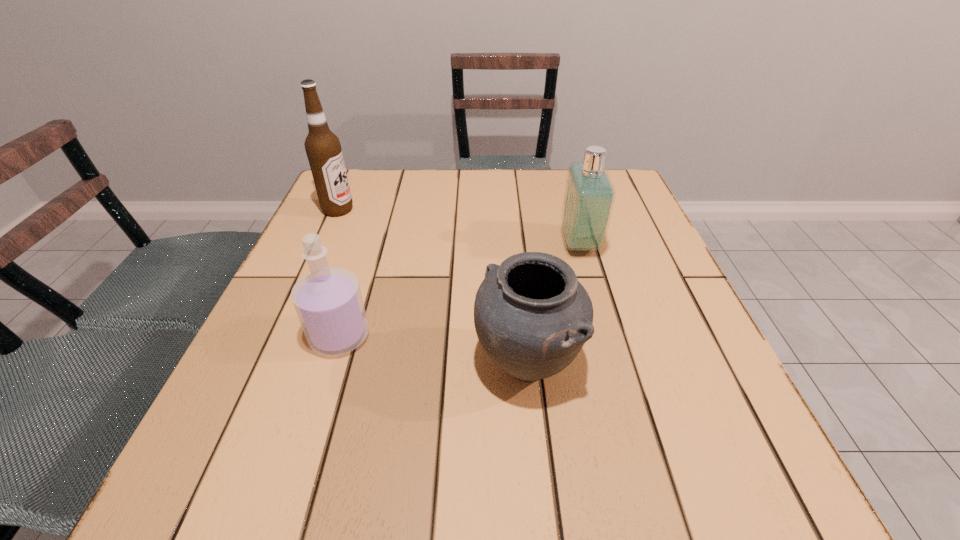
Image resolution: width=960 pixels, height=540 pixels. What are the coordinates of `free spot located 0.390m on the front label of the farther perfume` in the screenshot? It's located at (394, 244).

Image resolution: width=960 pixels, height=540 pixels. Find the location of `vacant space situated 0.190m on the back of the nearer perfume`. vacant space situated 0.190m on the back of the nearer perfume is located at coordinates (366, 254).

This screenshot has height=540, width=960. In order to click on free space located on the left of the urn in this screenshot , I will do `click(371, 364)`.

Locate an element on the screen. The height and width of the screenshot is (540, 960). object positioned at the far edge is located at coordinates (323, 148).

Identify the location of alcohol at the left edge. (323, 148).

Where is `perfume present at the left edge`? Image resolution: width=960 pixels, height=540 pixels. perfume present at the left edge is located at coordinates (328, 301).

Locate an element on the screen. This screenshot has height=540, width=960. object that is at the right edge is located at coordinates (589, 196).

Where is `object present at the far left corner`? object present at the far left corner is located at coordinates (323, 148).

You are a GUI agent. You are given a task and a screenshot of the screen. Output one action in this format:
    pyautogui.click(x=<x>, y=<y>)
    Task: Click on the vacant space at the far edge of the desktop
    This screenshot has height=540, width=960.
    Given the screenshot: What is the action you would take?
    pyautogui.click(x=499, y=209)

In the image, there is a desktop. Where is `vacant space at the near edge`? This screenshot has height=540, width=960. vacant space at the near edge is located at coordinates [536, 481].